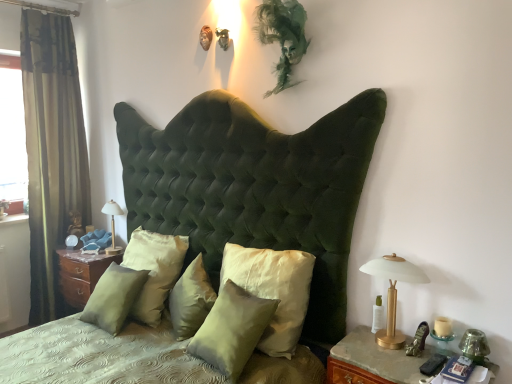
Where is `vacant space in front of gold metallic bedside lamp at right, which is counted as the second bedside lamp, starting from the left`? This screenshot has width=512, height=384. vacant space in front of gold metallic bedside lamp at right, which is counted as the second bedside lamp, starting from the left is located at coordinates (393, 363).